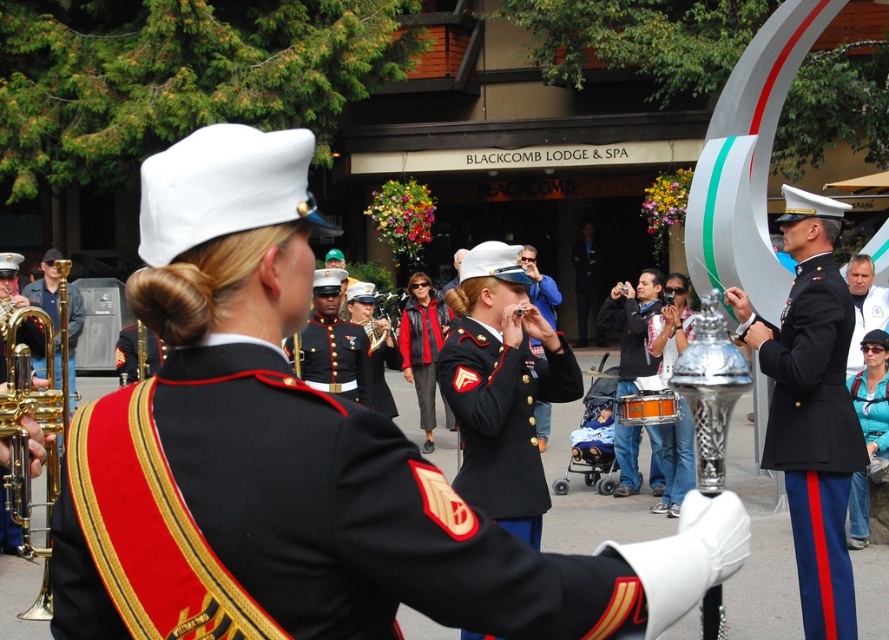
Question: Is black wool military jacket at center wider than red leather jacket at center?

Choices:
 (A) yes
 (B) no

Answer: (A)

Question: Which of the following is the closest to the observer?

Choices:
 (A) dark blue uniform at center
 (B) orange polished wood drum at center
 (C) black wool military jacket at center
 (D) red leather jacket at center

Answer: (C)

Question: Does teal fabric jacket at lower right have a greater width compared to dark blue uniform at center?

Choices:
 (A) yes
 (B) no

Answer: (B)

Question: Which object is closer to the camera taking this photo?

Choices:
 (A) shiny black uniform at center
 (B) orange drum at center
 (C) denim jacket at center

Answer: (A)

Question: Which is nearer to the dark blue uniform at center?

Choices:
 (A) orange drum at center
 (B) maroon fabric uniform at center

Answer: (A)

Question: Does gold brass trumpet at left come in front of shiny black uniform at center?

Choices:
 (A) yes
 (B) no

Answer: (B)